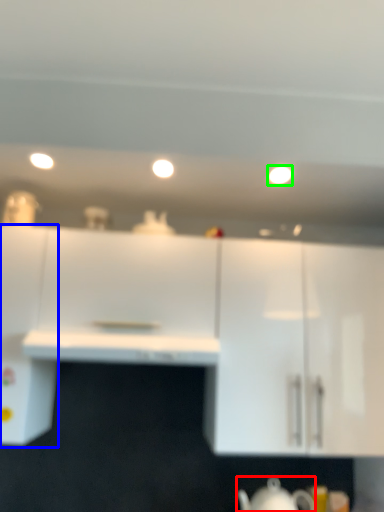
Question: Based on their relative distances, which object is farther from jug (highlighted by a red box)? Choose from cabinetry (highlighted by a blue box) and lighting (highlighted by a green box).

Choices:
 (A) cabinetry
 (B) lighting

Answer: (B)